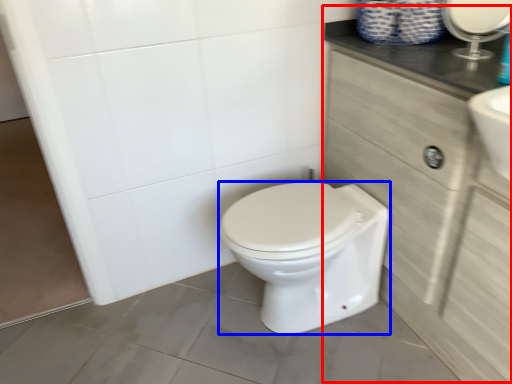
Question: Which point is further to the camera, cabinetry (highlighted by a red box) or bidet (highlighted by a blue box)?

Choices:
 (A) cabinetry
 (B) bidet

Answer: (B)